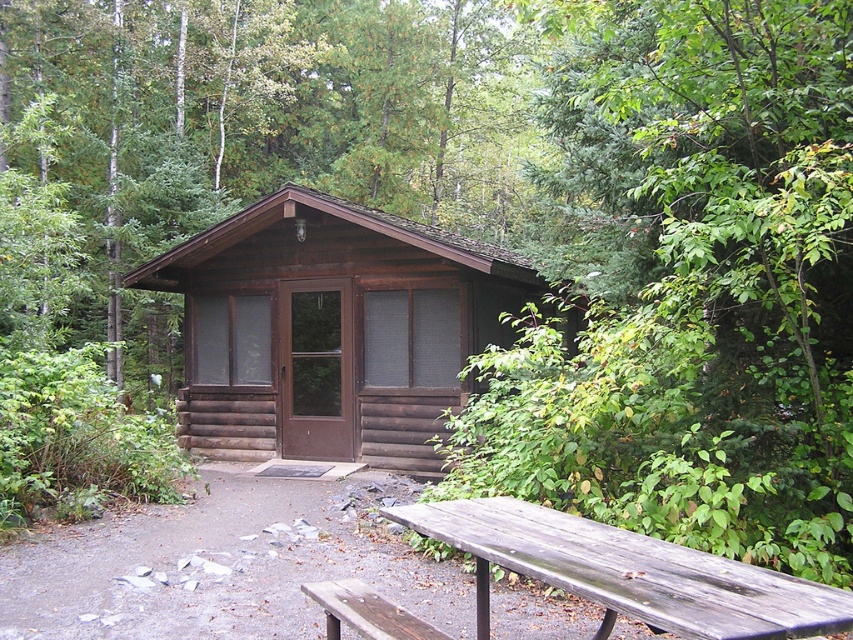
Consider the image. You are standing at the entrance of the brown log cabin at center and want to walk to the weathered wood picnic table at lower center. Which direction should you move relative to the cabin?

The brown log cabin at center is to the left of the weathered wood picnic table at lower center, so you should move to the right to reach the picnic table.